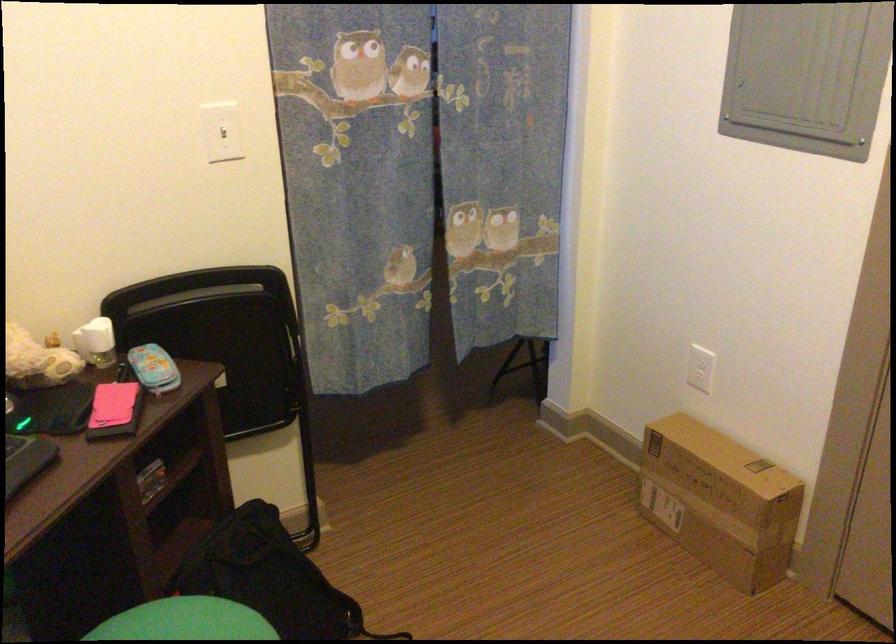
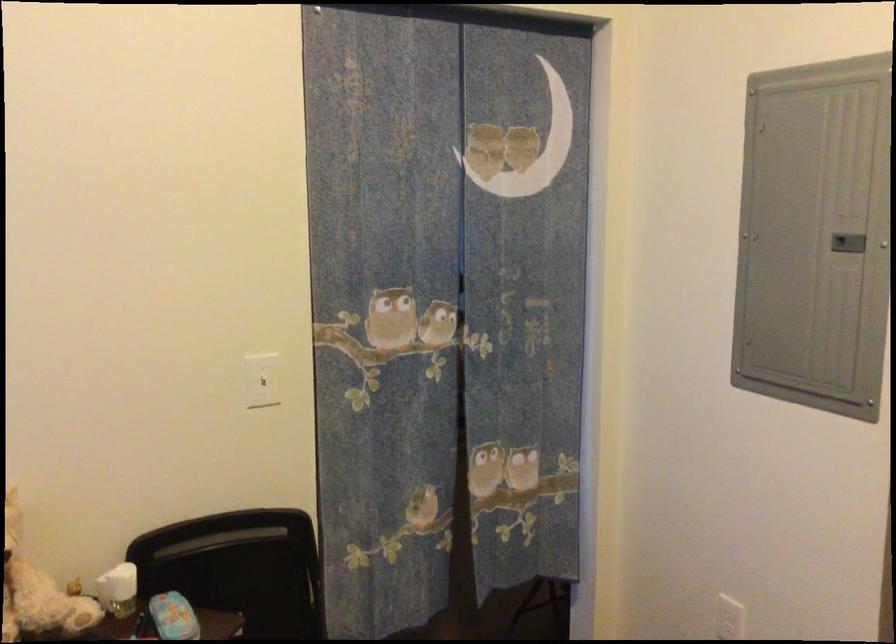
The images are taken continuously from a first-person perspective. In which direction are you moving?

The cameraman walked toward left, backward.